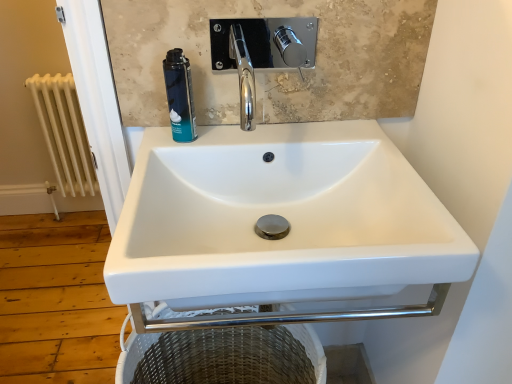
This screenshot has height=384, width=512. What do you see at coordinates (64, 133) in the screenshot?
I see `white painted metal radiator at left` at bounding box center [64, 133].

Describe the element at coordinates (280, 215) in the screenshot. I see `white ceramic sink at center` at that location.

Find the location of `white painted metal radiator at left`. white painted metal radiator at left is located at coordinates (64, 133).

Based on the photo, from a real-world perspective, which is physically below, white painted metal radiator at left or white ceramic sink at center?

white painted metal radiator at left is physically lower.

Is white painted metal radiator at left smaller than white ceramic sink at center?

Yes, white painted metal radiator at left is smaller than white ceramic sink at center.

Does white painted metal radiator at left come behind white ceramic sink at center?

Yes, it is.

Is white painted metal radiator at left shorter than white ceramic sink at center?

In fact, white painted metal radiator at left may be taller than white ceramic sink at center.

From the image's perspective, between blue matte shaving cream can at upper left and white ceramic sink at center, which one is located above?

From the image's view, blue matte shaving cream can at upper left is above.

Looking at this image, is white ceramic sink at center a part of blue matte shaving cream can at upper left?

That's incorrect, white ceramic sink at center is not inside blue matte shaving cream can at upper left.

Does point (179, 138) come farther from viewer compared to point (214, 306)?

Yes, it is behind point (214, 306).

Between blue matte shaving cream can at upper left and white ceramic sink at center, which one has smaller width?

blue matte shaving cream can at upper left.

Does blue matte shaving cream can at upper left lie in front of white painted metal radiator at left?

Yes, the depth of blue matte shaving cream can at upper left is less than that of white painted metal radiator at left.

From the image's perspective, which is below, blue matte shaving cream can at upper left or white painted metal radiator at left?

blue matte shaving cream can at upper left.

Can you see blue matte shaving cream can at upper left touching white painted metal radiator at left?

No, blue matte shaving cream can at upper left is not touching white painted metal radiator at left.

How many degrees apart are the facing directions of blue matte shaving cream can at upper left and white painted metal radiator at left?

2.24 degrees.

How different are the orientations of white ceramic sink at center and white painted metal radiator at left in degrees?

The facing directions of white ceramic sink at center and white painted metal radiator at left are 2.28 degrees apart.

Does white ceramic sink at center contain white painted metal radiator at left?

Definitely not — white painted metal radiator at left is not inside white ceramic sink at center.

Does white ceramic sink at center turn towards white painted metal radiator at left?

No, white ceramic sink at center is not oriented towards white painted metal radiator at left.

In the scene shown: Which is further, (291, 171) or (59, 144)?

The point (59, 144) is farther.

Find the location of `sink to the right of blue matte shaving cream can at upper left`. sink to the right of blue matte shaving cream can at upper left is located at coordinates (280, 215).

Is white ceramic sink at center shorter than blue matte shaving cream can at upper left?

No.

Considering the points (430, 273) and (176, 72), which point is in front, point (430, 273) or point (176, 72)?

Point (430, 273)

From the image's perspective, which one is positioned lower, white ceramic sink at center or blue matte shaving cream can at upper left?

white ceramic sink at center appears lower in the image.

From the image's perspective, is white painted metal radiator at left beneath blue matte shaving cream can at upper left?

Incorrect, from the image's perspective, white painted metal radiator at left is higher than blue matte shaving cream can at upper left.

From a real-world perspective, is white painted metal radiator at left located beneath blue matte shaving cream can at upper left?

Correct, in the physical world, white painted metal radiator at left is lower than blue matte shaving cream can at upper left.

At what (x,y) coordinates should I click in order to perform the action: click on mouthwash on the right of white painted metal radiator at left. Please return your answer as a coordinate pair (x, y). The width and height of the screenshot is (512, 384). Looking at the image, I should click on (179, 96).

Between white painted metal radiator at left and blue matte shaving cream can at upper left, which one appears on the left side from the viewer's perspective?

Positioned to the left is white painted metal radiator at left.

Where is `sink below the white painted metal radiator at left (from the image's perspective)`? This screenshot has height=384, width=512. sink below the white painted metal radiator at left (from the image's perspective) is located at coordinates (280, 215).

In order to click on sink on the right of blue matte shaving cream can at upper left in this screenshot , I will do `click(280, 215)`.

Looking at the image, which one is located further to white ceramic sink at center, blue matte shaving cream can at upper left or white painted metal radiator at left?

white painted metal radiator at left.

Estimate the real-world distances between objects in this image. Which object is further from white painted metal radiator at left, white ceramic sink at center or blue matte shaving cream can at upper left?

white ceramic sink at center lies further to white painted metal radiator at left than the other object.

Based on their spatial positions, is blue matte shaving cream can at upper left or white ceramic sink at center further from white painted metal radiator at left?

white ceramic sink at center is further to white painted metal radiator at left.

Which object lies further to the anchor point blue matte shaving cream can at upper left, white painted metal radiator at left or white ceramic sink at center?

The object further to blue matte shaving cream can at upper left is white painted metal radiator at left.

Which object lies nearer to the anchor point white ceramic sink at center, white painted metal radiator at left or blue matte shaving cream can at upper left?

Based on the image, blue matte shaving cream can at upper left appears to be nearer to white ceramic sink at center.

Estimate the real-world distances between objects in this image. Which object is further from blue matte shaving cream can at upper left, white ceramic sink at center or white painted metal radiator at left?

Among the two, white painted metal radiator at left is located further to blue matte shaving cream can at upper left.

I want to click on mouthwash between white ceramic sink at center and white painted metal radiator at left in the front-back direction, so click(x=179, y=96).